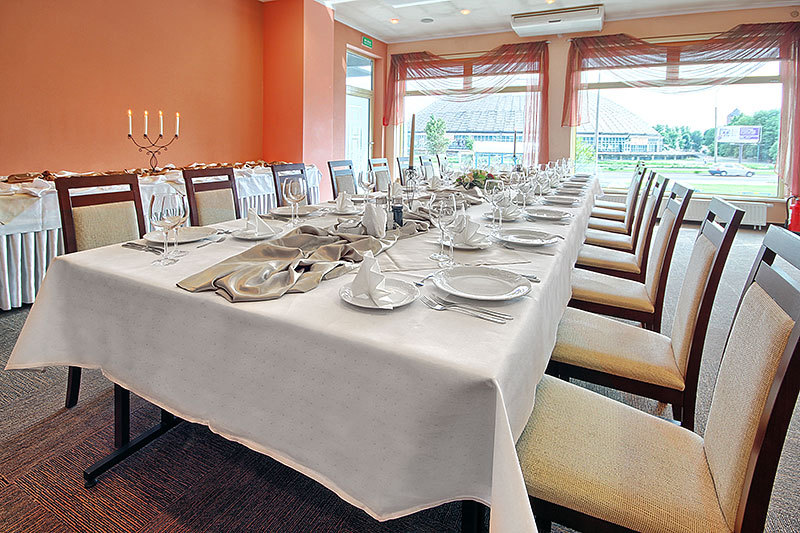
The height and width of the screenshot is (533, 800). In order to click on seats in this screenshot , I will do `click(642, 453)`, `click(626, 333)`, `click(626, 289)`, `click(618, 259)`, `click(618, 242)`, `click(616, 223)`, `click(616, 215)`, `click(616, 208)`.